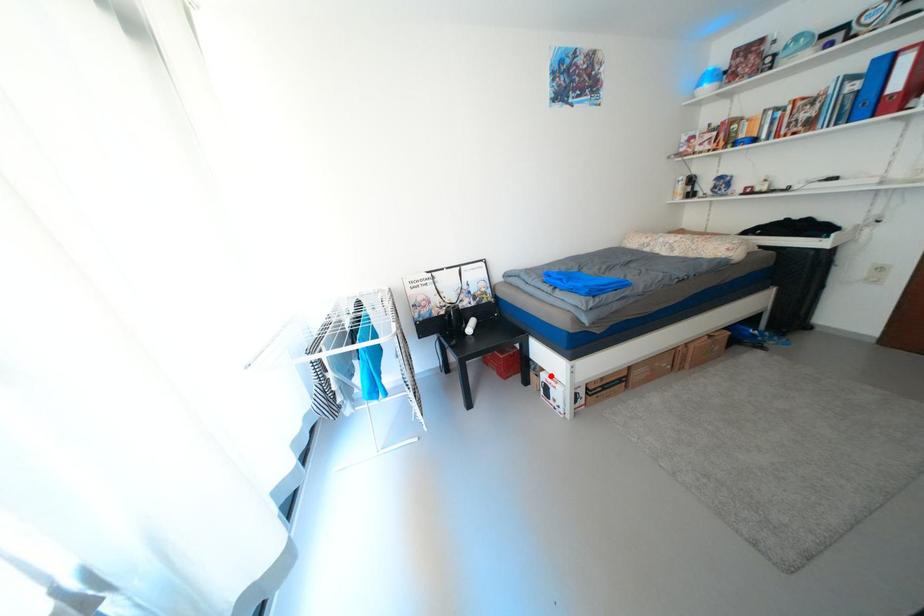
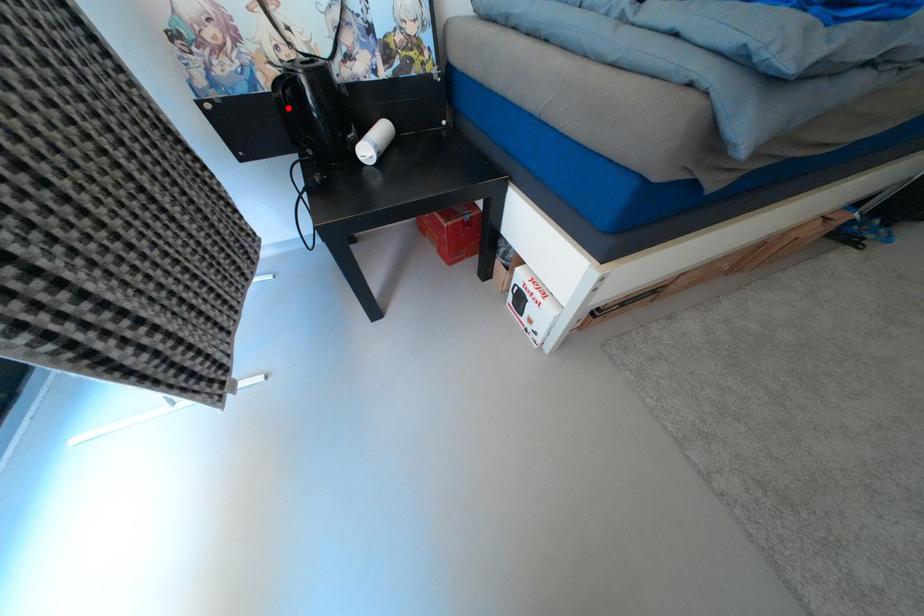
I am providing you with two images of the same scene from different viewpoints. A red point is marked on the first image and another point is marked on the second image. Does the point marked in image1 correspond to the same location as the one in image2?

No